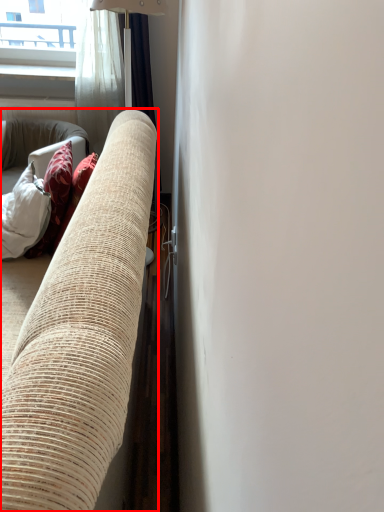
Question: From the image's perspective, where is studio couch (annotated by the red box) located in relation to curtain in the image?

Choices:
 (A) below
 (B) above

Answer: (A)